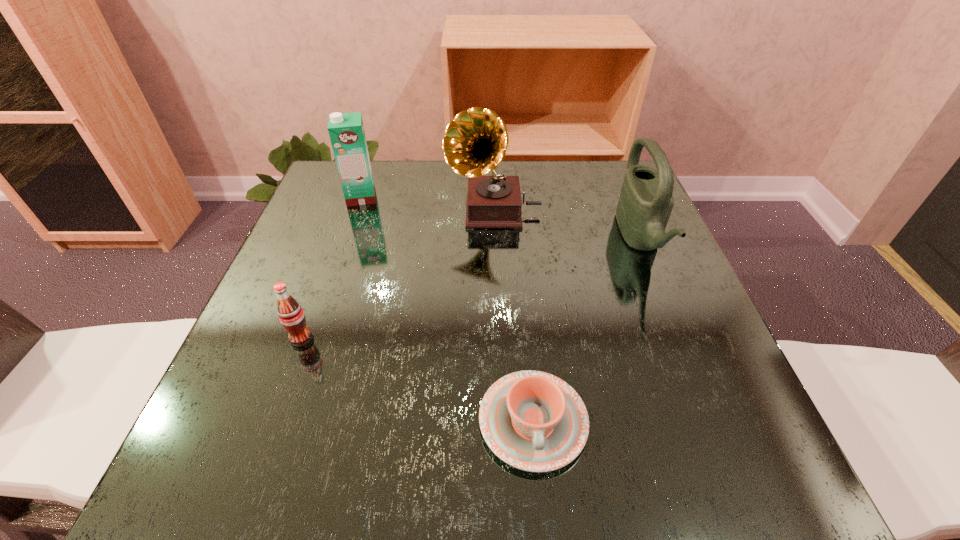
Locate an element on the screen. The height and width of the screenshot is (540, 960). phonograph record is located at coordinates (475, 142).

Locate an element on the screen. carton is located at coordinates (346, 130).

The height and width of the screenshot is (540, 960). Identify the location of watering can. (646, 201).

Where is `the second nearest object`? Image resolution: width=960 pixels, height=540 pixels. the second nearest object is located at coordinates (291, 315).

You are a GUI agent. You are given a task and a screenshot of the screen. Output one action in this format:
    pyautogui.click(x=<x>, y=<y>)
    Task: Click on the soda
    Image resolution: width=960 pixels, height=540 pixels.
    Given the screenshot: What is the action you would take?
    pyautogui.click(x=291, y=315)

At what (x,y) coordinates should I click in order to perform the action: click on the shortest object. Please return your answer as a coordinate pair (x, y). Looking at the image, I should click on (533, 421).

In order to click on chinaware in this screenshot , I will do `click(533, 421)`.

This screenshot has height=540, width=960. I want to click on vacant region located from the horn of the phonograph record, so click(425, 212).

What are the coordinates of `vacant space located from the horn of the phonograph record` in the screenshot? It's located at (324, 212).

The height and width of the screenshot is (540, 960). Identify the location of blank area located 0.150m from the horn of the phonograph record. (384, 212).